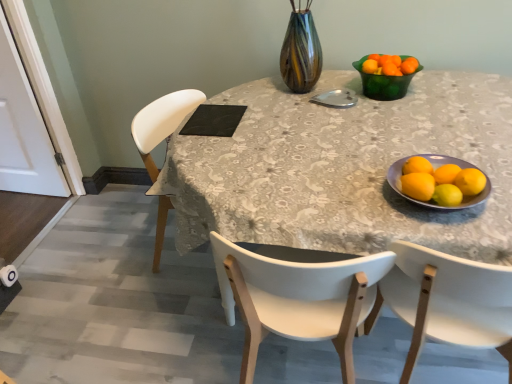
How much space does yellow matte lemon at right, acting as the first lemon starting from the right, occupy vertically?

yellow matte lemon at right, acting as the first lemon starting from the right, is 2.57 inches tall.

Describe the element at coordinates (418, 185) in the screenshot. I see `yellow matte lemon at right, positioned as the fourth lemon in right-to-left order` at that location.

The height and width of the screenshot is (384, 512). Find the location of `yellow matte lemon at lower right, the second lemon when ordered from right to left`. yellow matte lemon at lower right, the second lemon when ordered from right to left is located at coordinates (447, 195).

Describe the element at coordinates (447, 195) in the screenshot. I see `yellow matte lemon at lower right, the 3th lemon viewed from the left` at that location.

In order to click on matte ceramic bowl at right in this screenshot , I will do `click(428, 202)`.

Locate an element on the screen. the 2nd tangerine behind when counting from the white plastic chair at right, the 2th chair from the left is located at coordinates (409, 65).

Considering the relative sizes of white plastic chair at right, the 1th chair in the right-to-left sequence, and orange matte tangerine at upper right, which ranks as the first tangerine in right-to-left order, in the image provided, is white plastic chair at right, the 1th chair in the right-to-left sequence, thinner than orange matte tangerine at upper right, which ranks as the first tangerine in right-to-left order,?

In fact, white plastic chair at right, the 1th chair in the right-to-left sequence, might be wider than orange matte tangerine at upper right, which ranks as the first tangerine in right-to-left order.

From the image's perspective, is white plastic chair at right, the 2th chair from the left, over orange matte tangerine at upper right, which ranks as the first tangerine in right-to-left order?

No, from the image's perspective, white plastic chair at right, the 2th chair from the left, is not over orange matte tangerine at upper right, which ranks as the first tangerine in right-to-left order.

Which is nearer, (409, 273) or (409, 57)?

Clearly, point (409, 273) is closer to the camera than point (409, 57).

Looking at this image, does orange matte tangerine at upper right, placed as the 1th tangerine when sorted from left to right, have a smaller size compared to black matte placemat at upper center?

Indeed, orange matte tangerine at upper right, placed as the 1th tangerine when sorted from left to right, has a smaller size compared to black matte placemat at upper center.

Considering the relative sizes of orange matte tangerine at upper right, placed as the 1th tangerine when sorted from left to right, and black matte placemat at upper center in the image provided, is orange matte tangerine at upper right, placed as the 1th tangerine when sorted from left to right, shorter than black matte placemat at upper center?

In fact, orange matte tangerine at upper right, placed as the 1th tangerine when sorted from left to right, may be taller than black matte placemat at upper center.

Is orange matte tangerine at upper right, placed as the 1th tangerine when sorted from left to right, next to black matte placemat at upper center?

There is a gap between orange matte tangerine at upper right, placed as the 1th tangerine when sorted from left to right, and black matte placemat at upper center.

Would you say orange matte tangerine at upper right, placed as the 1th tangerine when sorted from left to right, is outside black matte placemat at upper center?

Indeed, orange matte tangerine at upper right, placed as the 1th tangerine when sorted from left to right, is completely outside black matte placemat at upper center.

Consider the image. From the image's perspective, which is below, matte ceramic bowl at right or yellow matte lemon at right, positioned as the fourth lemon in right-to-left order?

matte ceramic bowl at right, from the image's perspective.

Based on the photo, is matte ceramic bowl at right completely or partially outside of yellow matte lemon at right, positioned as the fourth lemon in right-to-left order?

Yes, matte ceramic bowl at right is outside of yellow matte lemon at right, positioned as the fourth lemon in right-to-left order.

Considering the relative sizes of matte ceramic bowl at right and yellow matte lemon at right, positioned as the fourth lemon in right-to-left order, in the image provided, is matte ceramic bowl at right wider than yellow matte lemon at right, positioned as the fourth lemon in right-to-left order,?

Correct, the width of matte ceramic bowl at right exceeds that of yellow matte lemon at right, positioned as the fourth lemon in right-to-left order.

Is the surface of matte ceramic bowl at right in direct contact with yellow matte lemon at right, positioned as the fourth lemon in right-to-left order?

Yes, matte ceramic bowl at right and yellow matte lemon at right, positioned as the fourth lemon in right-to-left order, clearly make contact.

Can you confirm if orange matte tangerine at upper right, the second tangerine viewed from the right, is smaller than matte ceramic bowl at right?

Correct, orange matte tangerine at upper right, the second tangerine viewed from the right, occupies less space than matte ceramic bowl at right.

Could you tell me if orange matte tangerine at upper right, the second tangerine viewed from the right, is turned towards matte ceramic bowl at right?

Yes, orange matte tangerine at upper right, the second tangerine viewed from the right, faces towards matte ceramic bowl at right.

Which object is thinner, orange matte tangerine at upper right, the second tangerine viewed from the right, or matte ceramic bowl at right?

orange matte tangerine at upper right, the second tangerine viewed from the right, is thinner.

Which is in front, orange matte tangerine at upper right, which ranks as the first tangerine in right-to-left order, or yellow matte lemon at right, the 3th lemon positioned from the right?

yellow matte lemon at right, the 3th lemon positioned from the right, is in front.

From the image's perspective, is orange matte tangerine at upper right, which ranks as the first tangerine in right-to-left order, under yellow matte lemon at right, which is the second lemon from left to right?

No.

Is orange matte tangerine at upper right, which ranks as the first tangerine in right-to-left order, facing towards yellow matte lemon at right, the 3th lemon positioned from the right?

Yes, orange matte tangerine at upper right, which ranks as the first tangerine in right-to-left order, faces towards yellow matte lemon at right, the 3th lemon positioned from the right.

Can you tell me how much orange matte tangerine at upper right, which ranks as the first tangerine in right-to-left order, and yellow matte lemon at right, which is the second lemon from left to right, differ in facing direction?

0.00578 degrees.

From a real-world perspective, is yellow matte lemon at right, the 3th lemon positioned from the right, below yellow matte lemon at lower right, the 3th lemon viewed from the left?

No, from a real-world perspective, yellow matte lemon at right, the 3th lemon positioned from the right, is not under yellow matte lemon at lower right, the 3th lemon viewed from the left.

From the image's perspective, which is above, yellow matte lemon at right, the 3th lemon positioned from the right, or yellow matte lemon at lower right, the 3th lemon viewed from the left?

From the image's view, yellow matte lemon at right, the 3th lemon positioned from the right, is above.

Which object is further away from the camera, yellow matte lemon at right, the 3th lemon positioned from the right, or yellow matte lemon at lower right, the second lemon when ordered from right to left?

yellow matte lemon at right, the 3th lemon positioned from the right.

Considering the relative positions of yellow matte lemon at lower right, the second lemon when ordered from right to left, and white wood chair at center, which is the 1th chair from left to right, in the image provided, is yellow matte lemon at lower right, the second lemon when ordered from right to left, to the left of white wood chair at center, which is the 1th chair from left to right, from the viewer's perspective?

No.

Is yellow matte lemon at lower right, the second lemon when ordered from right to left, next to white wood chair at center, which is the 1th chair from left to right?

No.

Is point (435, 187) more distant than point (341, 319)?

No, (435, 187) is closer to viewer.

Can you tell me how much yellow matte lemon at lower right, the 3th lemon viewed from the left, and white wood chair at center, which is the 1th chair from left to right, differ in facing direction?

yellow matte lemon at lower right, the 3th lemon viewed from the left, and white wood chair at center, which is the 1th chair from left to right, are facing 174 degrees away from each other.

From a real-world perspective, which chair is the 1st one underneath the orange matte tangerine at upper right, which ranks as the first tangerine in right-to-left order? Please provide its 2D coordinates.

[(447, 301)]

This screenshot has height=384, width=512. I want to click on tangerine that is the 1st object to the right of the black matte placemat at upper center, starting at the anchor, so click(x=390, y=69).

Estimate the real-world distances between objects in this image. Which object is further from yellow matte lemon at right, the fourth lemon positioned from the left, white plastic chair at right, the 1th chair in the right-to-left sequence, or white plastic chair at left?

white plastic chair at left.

Looking at the image, which one is located closer to white plastic chair at left, matte ceramic bowl at right or green translucent bowl at upper right?

Among the two, matte ceramic bowl at right is located nearer to white plastic chair at left.

Looking at the image, which one is located closer to orange matte tangerine at upper right, which ranks as the first tangerine in right-to-left order, white plastic chair at left or black matte placemat at upper center?

The object closer to orange matte tangerine at upper right, which ranks as the first tangerine in right-to-left order, is white plastic chair at left.

Based on their spatial positions, is white plastic chair at left or orange matte tangerine at upper right, the second tangerine viewed from the right, closer to yellow matte/orange at right?

white plastic chair at left is closer to yellow matte/orange at right.

Looking at the image, which one is located further to black matte placemat at upper center, white wood chair at center, acting as the second chair starting from the right, or white plastic chair at right, the 2th chair from the left?

Based on the image, white plastic chair at right, the 2th chair from the left, appears to be further to black matte placemat at upper center.

Based on their spatial positions, is black matte placemat at upper center or white wood chair at center, acting as the second chair starting from the right, further from yellow matte lemon at lower right, the second lemon when ordered from right to left?

black matte placemat at upper center lies further to yellow matte lemon at lower right, the second lemon when ordered from right to left, than the other object.

Which object lies nearer to the anchor point white plastic chair at right, the 1th chair in the right-to-left sequence, black matte placemat at upper center or yellow matte/orange at right?

Among the two, yellow matte/orange at right is located nearer to white plastic chair at right, the 1th chair in the right-to-left sequence.

From the image, which object appears to be farther from orange matte tangerine at upper right, placed as the 1th tangerine when sorted from left to right, white plastic chair at left or matte ceramic bowl at right?

Among the two, matte ceramic bowl at right is located further to orange matte tangerine at upper right, placed as the 1th tangerine when sorted from left to right.

Locate an element on the screen. chair positioned between white plastic chair at left and black matte placemat at upper center from near to far is located at coordinates (297, 298).

At what (x,y) coordinates should I click in order to perform the action: click on tangerine between yellow matte lemon at right, the 3th lemon positioned from the right, and orange matte tangerine at upper right, marked as the second tangerine in a left-to-right arrangement, from front to back. Please return your answer as a coordinate pair (x, y). Image resolution: width=512 pixels, height=384 pixels. Looking at the image, I should click on (390, 69).

Image resolution: width=512 pixels, height=384 pixels. Find the location of `bowl located between white plastic chair at left and yellow matte lemon at right, the 3th lemon positioned from the right, in the depth direction`. bowl located between white plastic chair at left and yellow matte lemon at right, the 3th lemon positioned from the right, in the depth direction is located at coordinates (428, 202).

The image size is (512, 384). I want to click on lemon positioned between yellow matte lemon at right, the fourth lemon positioned from the left, and orange matte tangerine at upper right, the second tangerine viewed from the right, from near to far, so click(417, 166).